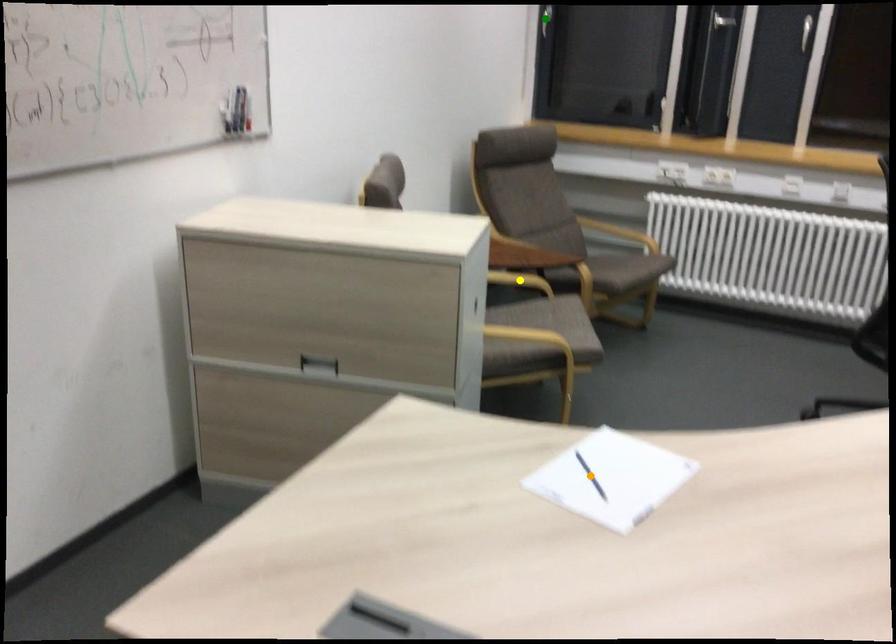
Order these from nearest to farthest:
yellow point
orange point
green point

orange point, yellow point, green point